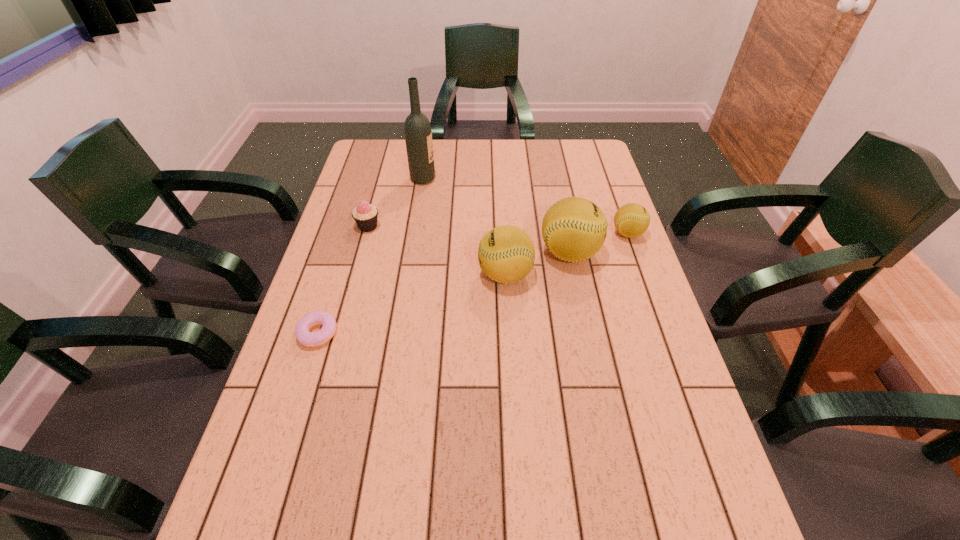
With all softballs evenly spaced, where should an extra softball be placed on the left to continue the pattern? Please point out a vacant space. Please provide its 2D coordinates. Your answer should be formatted as a tuple, i.e. [(x, y)], where the tuple contains the x and y coordinates of a point satisfying the conditions above.

[(435, 298)]